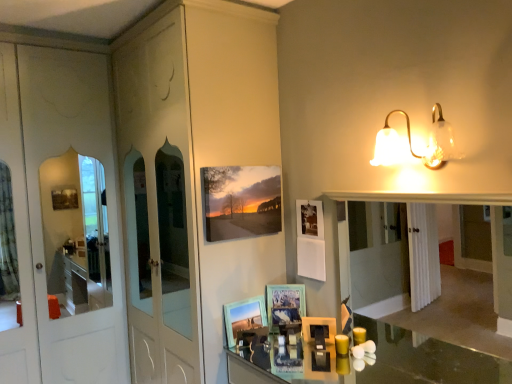
Find the location of `empty space that is ontop of clear glass mirror at center (from a real-world perspective)`. empty space that is ontop of clear glass mirror at center (from a real-world perspective) is located at coordinates [417, 193].